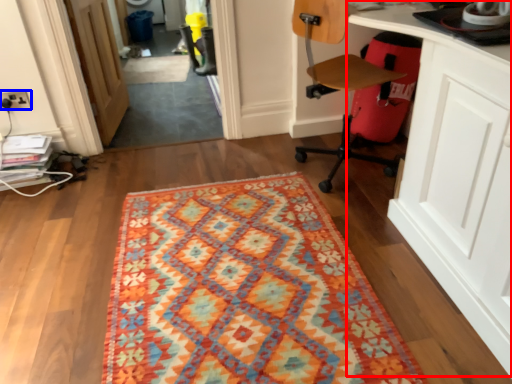
Question: Which object appears closest to the camera in this image, computer desk (highlighted by a red box) or electric outlet (highlighted by a blue box)?

Choices:
 (A) computer desk
 (B) electric outlet

Answer: (A)